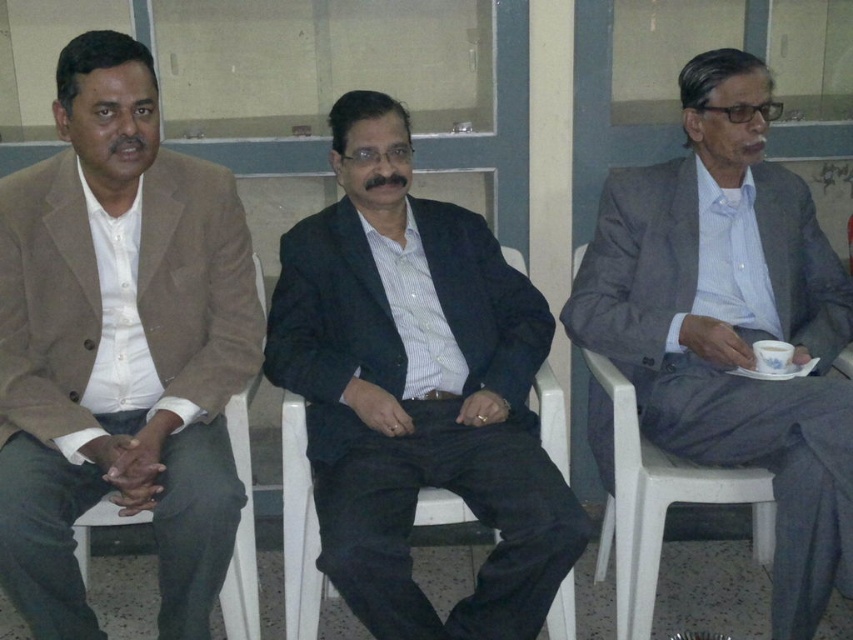
You are standing in front of the three men seated on white plastic chairs. The matte brown blazer at left is important for a task. Can you determine its exact position relative to the other objects in the scene?

The matte brown blazer at left is located at point (119, 346) in the scene, which means it is positioned on the left side among the three men seated on the white plastic chairs.

You are a delivery person who needs to place a small package on the table between the white plastic chair at left and the white ceramic cup at center right. The package requires 0.8 meters of space. Is there enough space between them to place the package?

The distance between the white plastic chair at left and the white ceramic cup at center right is 1.16 meters. Since the package requires 0.8 meters of space, there is enough space to place the package between them.